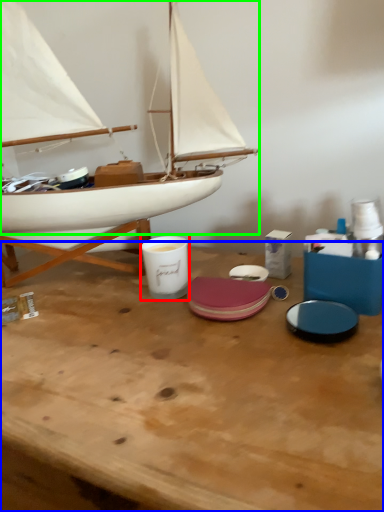
Question: Estimate the real-world distances between objects in this image. Which object is farther from tableware (highlighted by a red box), table (highlighted by a blue box) or boat (highlighted by a green box)?

Choices:
 (A) table
 (B) boat

Answer: (B)